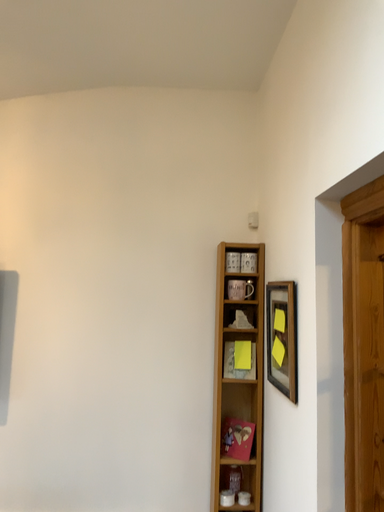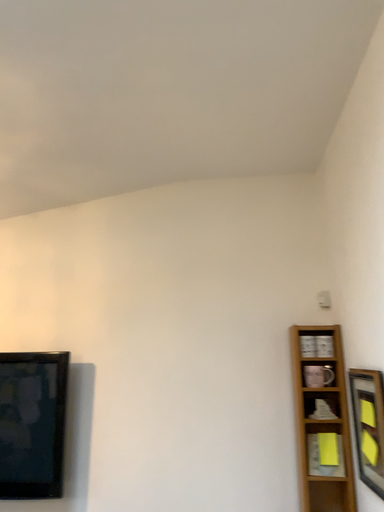
Question: Which way did the camera rotate in the video?

Choices:
 (A) rotated upward
 (B) rotated downward

Answer: (A)